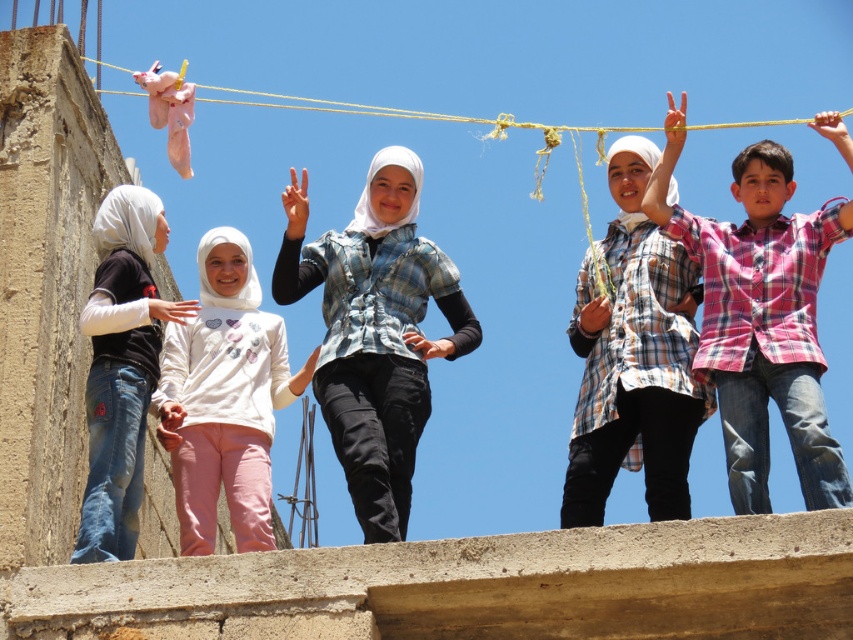
You are standing on the rooftop and want to walk from the point at coordinates point (x=706, y=294) to the point at coordinates point (x=683, y=266). Which direction should you move to reach your destination?

To move from point (x=706, y=294) to point (x=683, y=266), you should move backward since point (x=706, y=294) is in front of point (x=683, y=266).

You are a photographer trying to capture a group photo of the children. You notice the matte black shirt at left and the yellow rope at upper center in the frame. Which object should you adjust to ensure both are visible without overcrowding the composition?

Since the matte black shirt at left occupies less space than the yellow rope at upper center, you should adjust the yellow rope at upper center to reduce its size or position it differently to prevent overcrowding the composition.

You are a photographer trying to capture a group photo of the children. You notice two shirts at the center of the image. Which of the two shirts, the pink plaid shirt at center or the plaid cotton shirt at center, will appear larger in the photo?

The pink plaid shirt at center will appear larger in the photo because it is taller than the plaid cotton shirt at center.